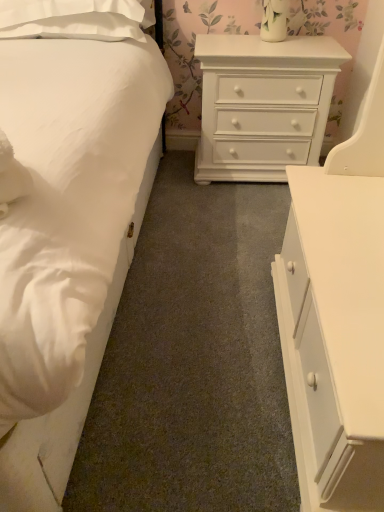
Question: Can you confirm if white painted wood chest of drawers at center, arranged as the second chest of drawers when viewed from the front, is taller than white smooth bed at left?

Choices:
 (A) yes
 (B) no

Answer: (B)

Question: Is the position of white painted wood chest of drawers at center, arranged as the 1th chest of drawers when viewed from the back, more distant than that of white smooth bed at left?

Choices:
 (A) yes
 (B) no

Answer: (A)

Question: Can you confirm if white painted wood chest of drawers at center, arranged as the 1th chest of drawers when viewed from the back, is shorter than white smooth bed at left?

Choices:
 (A) yes
 (B) no

Answer: (A)

Question: From a real-world perspective, is white painted wood chest of drawers at center, arranged as the 1th chest of drawers when viewed from the back, below white smooth bed at left?

Choices:
 (A) no
 (B) yes

Answer: (B)

Question: Can you confirm if white painted wood chest of drawers at center, arranged as the 1th chest of drawers when viewed from the back, is positioned to the right of white smooth bed at left?

Choices:
 (A) no
 (B) yes

Answer: (B)

Question: In the image, is white glossy chest of drawers at upper center, which ranks as the first chest of drawers in front-to-back order, positioned in front of or behind white smooth bed at left?

Choices:
 (A) behind
 (B) front

Answer: (A)

Question: From their relative heights in the image, would you say white glossy chest of drawers at upper center, which ranks as the first chest of drawers in front-to-back order, is taller or shorter than white smooth bed at left?

Choices:
 (A) tall
 (B) short

Answer: (A)

Question: From the image's perspective, is white glossy chest of drawers at upper center, the second chest of drawers from the back, positioned above or below white smooth bed at left?

Choices:
 (A) below
 (B) above

Answer: (A)

Question: From a real-world perspective, is white glossy chest of drawers at upper center, which ranks as the first chest of drawers in front-to-back order, positioned above or below white smooth bed at left?

Choices:
 (A) below
 (B) above

Answer: (B)

Question: Based on their positions, is white smooth bed at left located to the left or right of white glossy chest of drawers at upper center, the second chest of drawers from the back?

Choices:
 (A) left
 (B) right

Answer: (A)

Question: Considering the positions of white smooth bed at left and white glossy chest of drawers at upper center, the second chest of drawers from the back, in the image, is white smooth bed at left wider or thinner than white glossy chest of drawers at upper center, the second chest of drawers from the back,?

Choices:
 (A) thin
 (B) wide

Answer: (B)

Question: From the image's perspective, is white smooth bed at left located above or below white glossy chest of drawers at upper center, the second chest of drawers from the back?

Choices:
 (A) below
 (B) above

Answer: (B)

Question: Does point (11, 258) appear closer or farther from the camera than point (274, 263)?

Choices:
 (A) closer
 (B) farther

Answer: (A)

Question: Considering their positions, is white painted wood chest of drawers at center, arranged as the second chest of drawers when viewed from the front, located in front of or behind white soft pillow at upper left?

Choices:
 (A) behind
 (B) front

Answer: (A)

Question: In terms of height, does white painted wood chest of drawers at center, arranged as the 1th chest of drawers when viewed from the back, look taller or shorter compared to white soft pillow at upper left?

Choices:
 (A) short
 (B) tall

Answer: (B)